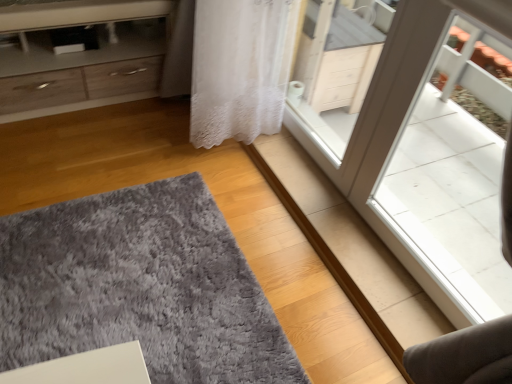
Measure the distance between point (42, 254) and camera.

They are 1.45 meters apart.

This screenshot has width=512, height=384. I want to click on gray shaggy rug at lower left, so click(x=140, y=287).

The height and width of the screenshot is (384, 512). Describe the element at coordinates (140, 287) in the screenshot. I see `gray shaggy rug at lower left` at that location.

The image size is (512, 384). I want to click on matte wood chest of drawers at upper left, so click(80, 56).

Measure the distance between matte wood chest of drawers at upper left and camera.

They are 5.27 feet apart.

The height and width of the screenshot is (384, 512). Describe the element at coordinates (80, 56) in the screenshot. I see `matte wood chest of drawers at upper left` at that location.

This screenshot has width=512, height=384. In order to click on gray shaggy rug at lower left in this screenshot , I will do `click(140, 287)`.

Which object is positioned more to the left, matte wood chest of drawers at upper left or gray shaggy rug at lower left?

matte wood chest of drawers at upper left is more to the left.

Is matte wood chest of drawers at upper left positioned in front of gray shaggy rug at lower left?

No, matte wood chest of drawers at upper left is behind gray shaggy rug at lower left.

Considering the positions of point (101, 95) and point (60, 242), is point (101, 95) closer or farther from the camera than point (60, 242)?

Clearly, point (101, 95) is more distant from the camera than point (60, 242).

From the image's perspective, does matte wood chest of drawers at upper left appear higher than gray shaggy rug at lower left?

Yes.

From a real-world perspective, who is located lower, matte wood chest of drawers at upper left or gray shaggy rug at lower left?

From a 3D spatial view, gray shaggy rug at lower left is below.

Considering the relative sizes of matte wood chest of drawers at upper left and gray shaggy rug at lower left in the image provided, is matte wood chest of drawers at upper left thinner than gray shaggy rug at lower left?

Indeed, matte wood chest of drawers at upper left has a lesser width compared to gray shaggy rug at lower left.

Considering the sizes of objects matte wood chest of drawers at upper left and gray shaggy rug at lower left in the image provided, who is taller, matte wood chest of drawers at upper left or gray shaggy rug at lower left?

With more height is matte wood chest of drawers at upper left.

Based on their sizes in the image, would you say matte wood chest of drawers at upper left is bigger or smaller than gray shaggy rug at lower left?

Clearly, matte wood chest of drawers at upper left is larger in size than gray shaggy rug at lower left.

Would you say matte wood chest of drawers at upper left is inside or outside gray shaggy rug at lower left?

matte wood chest of drawers at upper left is not enclosed by gray shaggy rug at lower left.

Can you see matte wood chest of drawers at upper left touching gray shaggy rug at lower left?

There is a gap between matte wood chest of drawers at upper left and gray shaggy rug at lower left.

Is matte wood chest of drawers at upper left facing towards gray shaggy rug at lower left?

Yes.

How different are the orientations of matte wood chest of drawers at upper left and gray shaggy rug at lower left in degrees?

The angle between the facing direction of matte wood chest of drawers at upper left and the facing direction of gray shaggy rug at lower left is 91.2 degrees.

Where is `chest of drawers above the gray shaggy rug at lower left (from a real-world perspective)`? The width and height of the screenshot is (512, 384). chest of drawers above the gray shaggy rug at lower left (from a real-world perspective) is located at coordinates (80, 56).

From the picture: Would you say gray shaggy rug at lower left is to the left or to the right of matte wood chest of drawers at upper left in the picture?

In the image, gray shaggy rug at lower left appears on the right side of matte wood chest of drawers at upper left.

Which is behind, gray shaggy rug at lower left or matte wood chest of drawers at upper left?

Result: matte wood chest of drawers at upper left is further away from the camera.

Considering the points (78, 334) and (63, 78), which point is behind, point (78, 334) or point (63, 78)?

The point (63, 78) is farther.

From the image's perspective, is gray shaggy rug at lower left over matte wood chest of drawers at upper left?

No.

From a real-world perspective, relative to matte wood chest of drawers at upper left, is gray shaggy rug at lower left vertically above or below?

Clearly, from a real-world perspective, gray shaggy rug at lower left is below matte wood chest of drawers at upper left.

Considering the sizes of objects gray shaggy rug at lower left and matte wood chest of drawers at upper left in the image provided, who is wider, gray shaggy rug at lower left or matte wood chest of drawers at upper left?

gray shaggy rug at lower left is wider.

Is gray shaggy rug at lower left shorter than matte wood chest of drawers at upper left?

Indeed, gray shaggy rug at lower left has a lesser height compared to matte wood chest of drawers at upper left.

Can you confirm if gray shaggy rug at lower left is smaller than matte wood chest of drawers at upper left?

Correct, gray shaggy rug at lower left occupies less space than matte wood chest of drawers at upper left.

Is matte wood chest of drawers at upper left completely or partially inside gray shaggy rug at lower left?

Actually, matte wood chest of drawers at upper left is outside gray shaggy rug at lower left.

Is gray shaggy rug at lower left touching matte wood chest of drawers at upper left?

No, gray shaggy rug at lower left is not with matte wood chest of drawers at upper left.

Is gray shaggy rug at lower left aimed at matte wood chest of drawers at upper left?

No, gray shaggy rug at lower left is not oriented towards matte wood chest of drawers at upper left.

This screenshot has width=512, height=384. I want to click on chest of drawers behind the gray shaggy rug at lower left, so [80, 56].

Identify the location of chest of drawers on the left of gray shaggy rug at lower left. (80, 56).

Where is `the chest of drawers that appears behind the gray shaggy rug at lower left`? the chest of drawers that appears behind the gray shaggy rug at lower left is located at coordinates (80, 56).